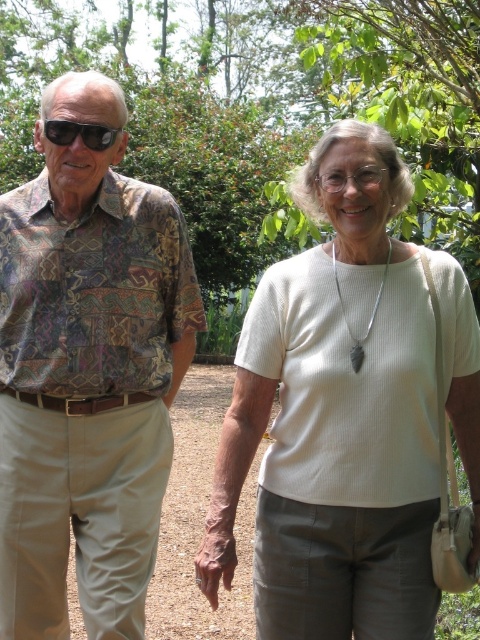
Does printed fabric shirt at left have a lesser height compared to black plastic sunglasses at left?

Incorrect, printed fabric shirt at left's height does not fall short of black plastic sunglasses at left's.

Who is shorter, printed fabric shirt at left or black plastic sunglasses at left?

black plastic sunglasses at left

Identify the location of printed fabric shirt at left. This screenshot has height=640, width=480. (86, 372).

What do you see at coordinates (336, 417) in the screenshot?
I see `white ribbed shirt at center` at bounding box center [336, 417].

I want to click on white ribbed shirt at center, so click(336, 417).

Who is more distant from viewer, (316, 209) or (105, 621)?

The point (105, 621) is behind.

Image resolution: width=480 pixels, height=640 pixels. Identify the location of white ribbed shirt at center. pos(336,417).

Consider the image. Is white ribbed shirt at center positioned at the back of black plastic sunglasses at left?

That is False.

What do you see at coordinates (336, 417) in the screenshot?
I see `white ribbed shirt at center` at bounding box center [336, 417].

The height and width of the screenshot is (640, 480). I want to click on white ribbed shirt at center, so click(x=336, y=417).